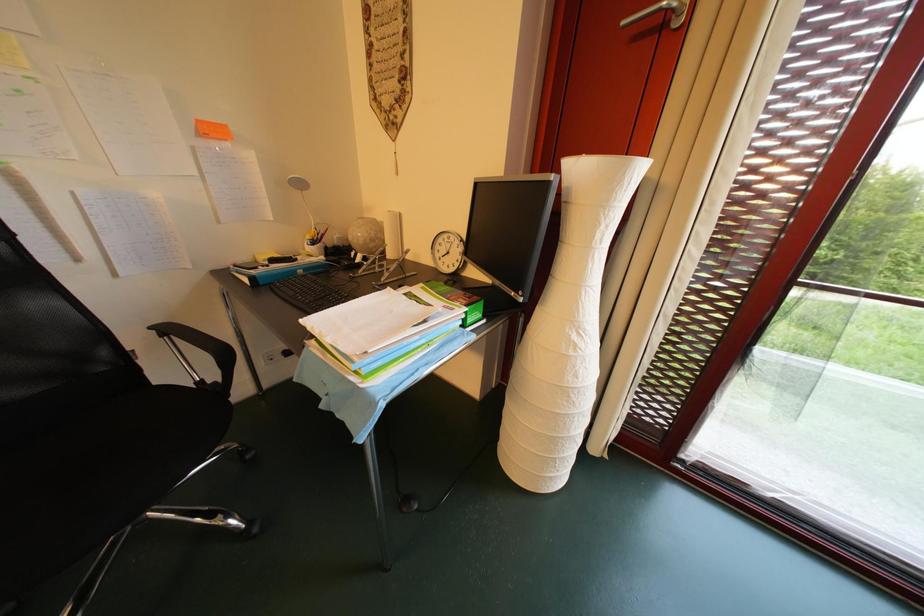
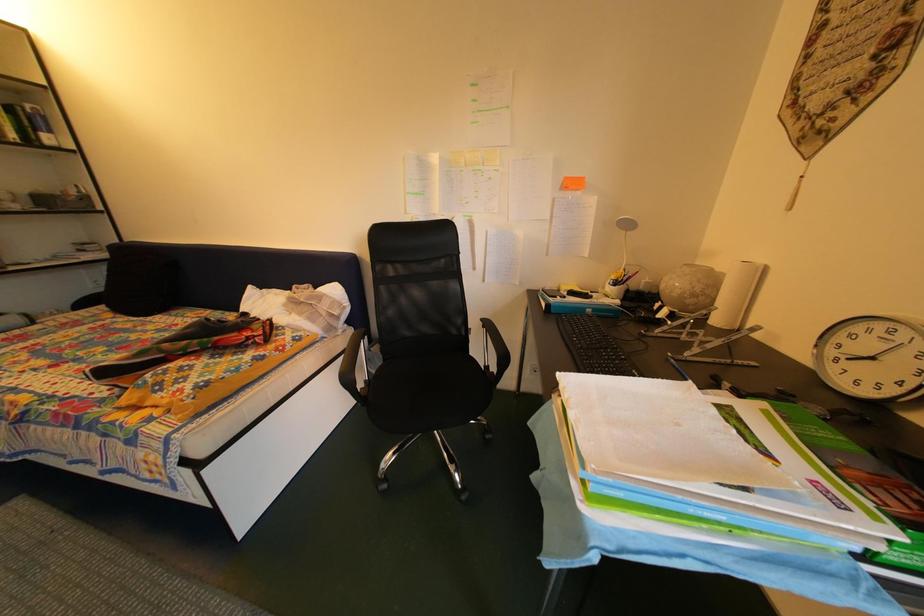
Question: The camera is either moving clockwise (left) or counter-clockwise (right) around the object. The first image is from the beginning of the video and the second image is from the end. Is the camera moving left or right when shooting the video?

Choices:
 (A) Left
 (B) Right

Answer: (B)